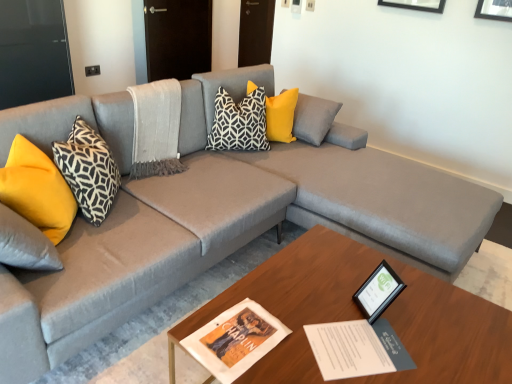
I want to click on free region under white paper booklet at center (from a real-world perspective), so click(355, 347).